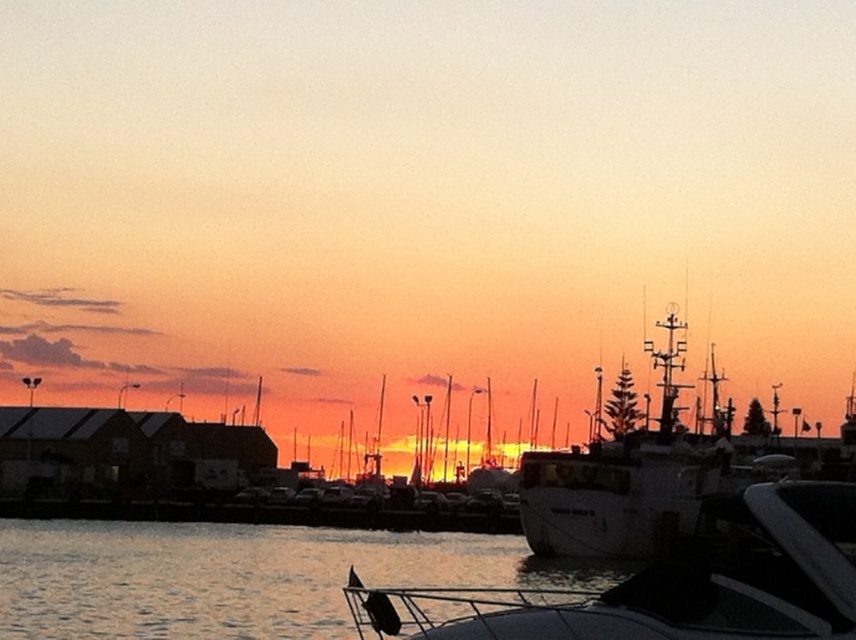
You are standing at the edge of the dock in the harbor scene. You notice a point marked at coordinates (235, 577). What does this point represent in the scene?

The point at coordinates (235, 577) represents the glistening water at lower center.

You are standing at the edge of the harbor and want to take a photo of the glistening water at lower center. If your camera can focus on objects up to 10 meters away, will you need to adjust your position to capture it clearly?

The glistening water at lower center is 10.68 meters away from the camera. Since the camera can only focus up to 10 meters, you need to move closer to ensure it is within the focus range.

You are standing at the edge of the dock in the harbor scene. There are two points marked on the water surface in front of you. The first point is at coordinates point (394, 570) and the second is at point (759, 486). If you want to throw a small floating object to the point closer to you, which coordinate should you aim for?

You should aim for point (394, 570) because it is closer to you than point (759, 486).